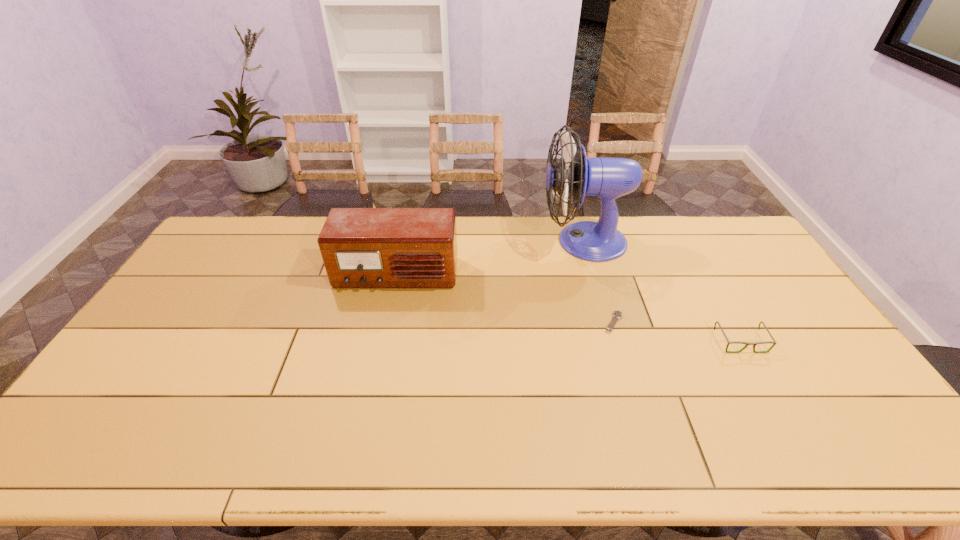
Locate an element on the screen. The height and width of the screenshot is (540, 960). unoccupied position between the watch and the leftmost object is located at coordinates (505, 299).

Locate an element on the screen. The image size is (960, 540). free space between the spectacles and the fan is located at coordinates tap(661, 292).

Where is `free space between the rightmost object and the radio receiver`? This screenshot has width=960, height=540. free space between the rightmost object and the radio receiver is located at coordinates (568, 308).

Identify the location of vacant space that is in between the watch and the tallest object. This screenshot has height=540, width=960. (598, 282).

Find the location of `free spot between the watch and the tallest object`. free spot between the watch and the tallest object is located at coordinates (598, 282).

This screenshot has height=540, width=960. What are the coordinates of `free area in between the fan and the shortest object` in the screenshot? It's located at (598, 282).

At what (x,y) coordinates should I click in order to perform the action: click on vacant area between the shortest object and the radio receiver. Please return your answer as a coordinate pair (x, y). This screenshot has height=540, width=960. Looking at the image, I should click on (505, 299).

Locate an element on the screen. free space between the spectacles and the tallest object is located at coordinates (661, 292).

Where is `blank region between the shortest object and the radio receiver`? Image resolution: width=960 pixels, height=540 pixels. blank region between the shortest object and the radio receiver is located at coordinates (505, 299).

Locate which object ranks third in proximity to the third tallest object. Please provide its 2D coordinates. Your answer should be formatted as a tuple, i.e. [(x, y)], where the tuple contains the x and y coordinates of a point satisfying the conditions above.

[(361, 247)]